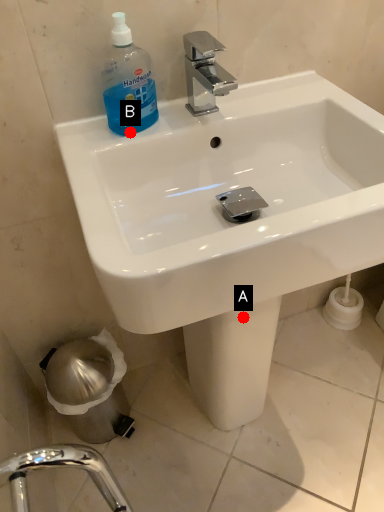
Question: Two points are circled on the image, labeled by A and B beside each circle. Which point is closer to the camera taking this photo?

Choices:
 (A) A is closer
 (B) B is closer

Answer: (B)